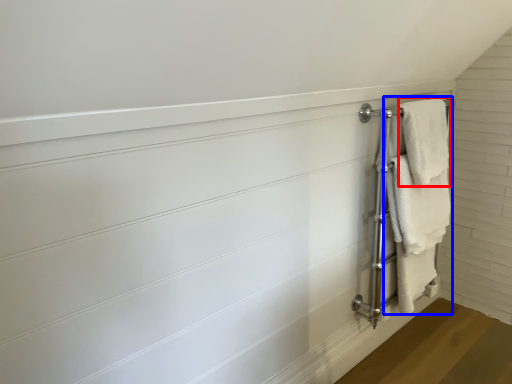
Question: Which of the following is the farthest to the observer, bath towel (highlighted by a red box) or bath towel (highlighted by a blue box)?

Choices:
 (A) bath towel
 (B) bath towel

Answer: (A)